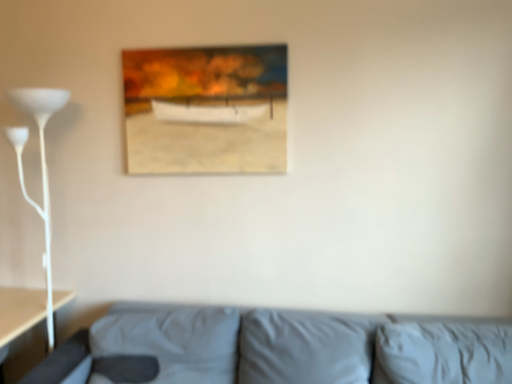
Question: From a real-world perspective, is wooden frame at upper center physically located above or below white glossy floor lamp at left?

Choices:
 (A) above
 (B) below

Answer: (A)

Question: Visually, is wooden frame at upper center positioned to the left or to the right of white glossy floor lamp at left?

Choices:
 (A) right
 (B) left

Answer: (A)

Question: Considering the real-world distances, which object is farthest from the white glossy floor lamp at left?

Choices:
 (A) wooden frame at upper center
 (B) gray fabric couch at lower center

Answer: (B)

Question: Which is farther from the white glossy floor lamp at left?

Choices:
 (A) wooden frame at upper center
 (B) gray fabric couch at lower center

Answer: (B)